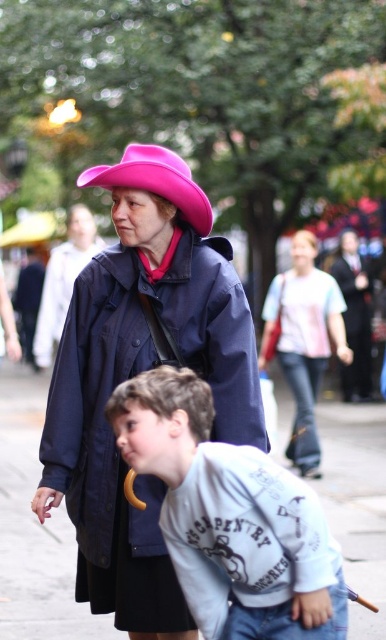
Can you confirm if navy blue coat at center is bigger than pink matte/cloth cowboy hat at upper center?

No.

Does point (172, 284) come in front of point (147, 156)?

No, (172, 284) is further to viewer.

Between point (237, 280) and point (189, 193), which one is positioned in front?

Point (189, 193)

Locate an element on the screen. navy blue coat at center is located at coordinates point(142,368).

Can you confirm if white cotton shirt at center is wider than dark gray suit at center?

Yes, white cotton shirt at center is wider than dark gray suit at center.

Does white cotton shirt at center appear on the left side of dark gray suit at center?

Correct, you'll find white cotton shirt at center to the left of dark gray suit at center.

Where is `white cotton shirt at center`? This screenshot has height=640, width=386. white cotton shirt at center is located at coordinates (304, 340).

Between navy blue coat at center and white cotton shirt at lower center, which one is positioned higher?

navy blue coat at center is higher up.

Measure the distance between navy blue coat at center and camera.

The distance of navy blue coat at center from camera is 4.35 meters.

This screenshot has height=640, width=386. I want to click on navy blue coat at center, so click(x=142, y=368).

At what (x,y) coordinates should I click in order to perform the action: click on navy blue coat at center. Please return your answer as a coordinate pair (x, y). The image size is (386, 640). Looking at the image, I should click on (142, 368).